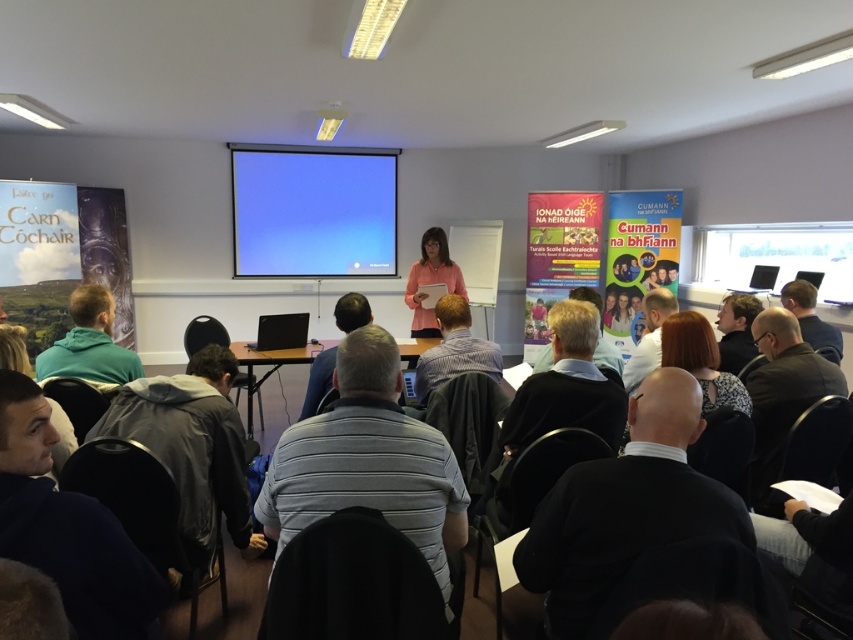
Does gray striped shirt at center have a greater width compared to dark gray hoodie at lower left?

No.

Does gray striped shirt at center appear under dark gray hoodie at lower left?

No, gray striped shirt at center is not below dark gray hoodie at lower left.

Describe the element at coordinates (368, 461) in the screenshot. The height and width of the screenshot is (640, 853). I see `gray striped shirt at center` at that location.

Locate an element on the screen. gray striped shirt at center is located at coordinates (368, 461).

Is striped shirt at center smaller than pink fabric at center?

No, striped shirt at center is not smaller than pink fabric at center.

Locate an element on the screen. This screenshot has width=853, height=640. striped shirt at center is located at coordinates (454, 349).

Locate an element on the screen. Image resolution: width=853 pixels, height=640 pixels. striped shirt at center is located at coordinates (454, 349).

Does black fabric jacket at lower right have a greater width compared to gray striped shirt at center?

No.

Is point (682, 468) positioned behind point (376, 326)?

No, (682, 468) is in front of (376, 326).

Is point (650, 451) positioned before point (419, 528)?

Yes, point (650, 451) is closer to viewer.

You are a GUI agent. You are given a task and a screenshot of the screen. Output one action in this format:
    pyautogui.click(x=<x>, y=<y>)
    Task: Click on the black fabric jacket at lower right
    The image size is (853, 640).
    Given the screenshot: What is the action you would take?
    pyautogui.click(x=625, y=506)